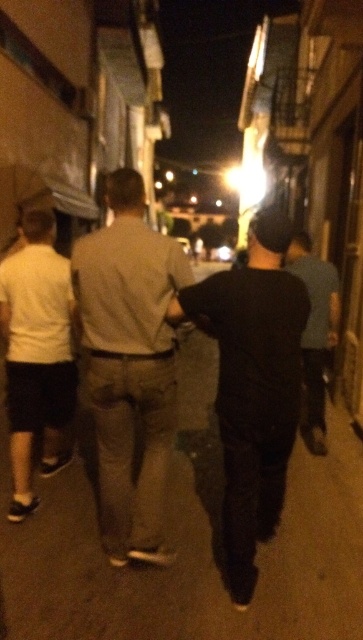
Measure the distance between light brown denim pants at center and dark gray pants at center.

6.02 feet

Which is in front, point (139, 481) or point (319, 326)?

Point (139, 481) is more forward.

At what (x,y) coordinates should I click in order to perform the action: click on light brown denim pants at center. Please return your answer as a coordinate pair (x, y). This screenshot has height=640, width=363. Looking at the image, I should click on (128, 364).

Which is above, light brown denim pants at center or black matte shirt at center?

light brown denim pants at center is higher up.

Who is positioned more to the left, light brown denim pants at center or black matte shirt at center?

Positioned to the left is light brown denim pants at center.

Which is behind, point (116, 209) or point (250, 356)?

The point (116, 209) is behind.

The width and height of the screenshot is (363, 640). Identify the location of light brown denim pants at center. (128, 364).

Is white matte shirt at left further to camera compared to dark gray pants at center?

No, it is not.

Identify the location of white matte shirt at left. (37, 355).

I want to click on white matte shirt at left, so click(x=37, y=355).

Where is `white matte shirt at left`? white matte shirt at left is located at coordinates (37, 355).